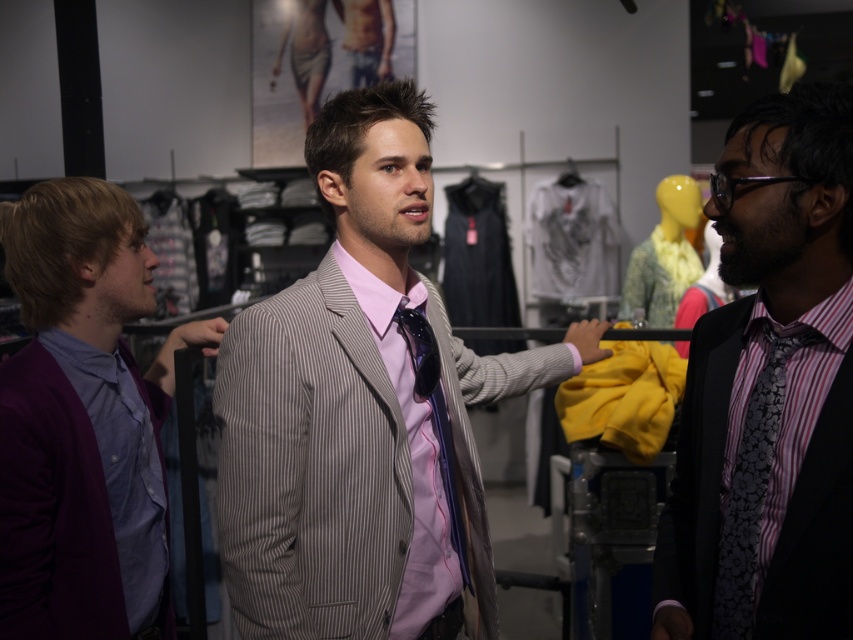
You are standing at the entrance of the clothing store and notice two points marked in the scene. The first point is at coordinates point (822,467) and the second is at point (732,586). Which of these two points is closer to you?

Point (822,467) is in front of point (732,586), so it is closer to you.

You are a customer in the clothing store and want to know which item is on the right side between the striped fabric suit at center and the purple wool sweater at left. According to the scene, which one is positioned to the right?

The striped fabric suit at center is positioned on the right side of the purple wool sweater at left, so the striped fabric suit at center is the one on the right.